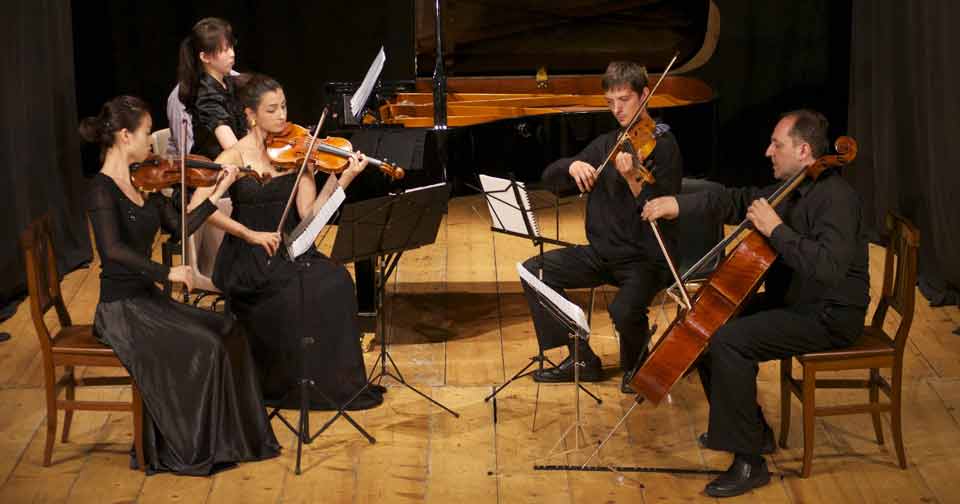
You are a GUI agent. You are given a task and a screenshot of the screen. Output one action in this format:
    pyautogui.click(x=<x>, y=<y>)
    Task: Click on the piano lid
    This screenshot has height=504, width=960.
    Given the screenshot: What is the action you would take?
    pyautogui.click(x=514, y=25)